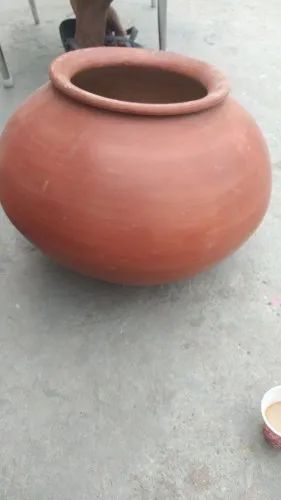
At what (x,y) coordinates should I click in order to perform the action: click on chair legs. Please return your answer as a coordinate pair (x, y). Looking at the image, I should click on (162, 33), (3, 68), (37, 16), (151, 5).